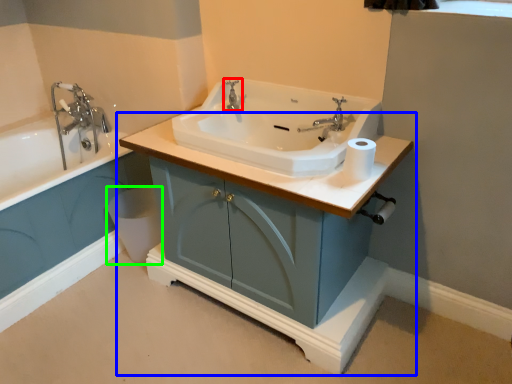
Question: Which object is the closest to the tap (highlighted by a red box)? Choose among these: bathroom cabinet (highlighted by a blue box) or toilet bowl (highlighted by a green box).

Choices:
 (A) bathroom cabinet
 (B) toilet bowl

Answer: (A)